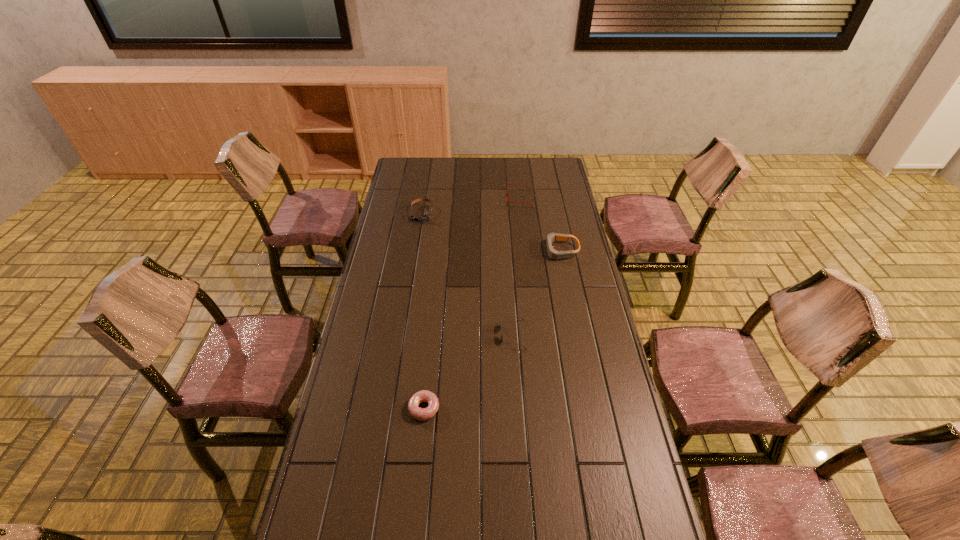
Image resolution: width=960 pixels, height=540 pixels. What are the coordinates of `vacant region located 0.390m on the face of the spectacles` in the screenshot? It's located at (428, 199).

I want to click on vacant area situated 0.390m on the face of the spectacles, so click(x=428, y=199).

Identify the location of vacant area situated on the front and back of the right goggles. (521, 251).

This screenshot has width=960, height=540. What are the coordinates of `free space located on the front and back of the right goggles` in the screenshot? It's located at (454, 251).

Where is `free space located on the front and back of the right goggles`? free space located on the front and back of the right goggles is located at coordinates (493, 251).

Find the location of a particular element. vacant space situated 0.360m on the front-facing side of the farther goggles is located at coordinates (412, 275).

At what (x,y) coordinates should I click in order to perform the action: click on vacant space located 0.190m on the front of the doughnut. Please return your answer as a coordinate pair (x, y). Looking at the image, I should click on (417, 487).

Where is `vacant space located on the lenses of the farther sunglasses`? This screenshot has width=960, height=540. vacant space located on the lenses of the farther sunglasses is located at coordinates click(392, 335).

Find the location of a particular element. The width and height of the screenshot is (960, 540). vacant point located 0.280m on the lenses of the farther sunglasses is located at coordinates (422, 335).

The height and width of the screenshot is (540, 960). In order to click on free space located on the lenses of the farther sunglasses in this screenshot , I will do `click(411, 335)`.